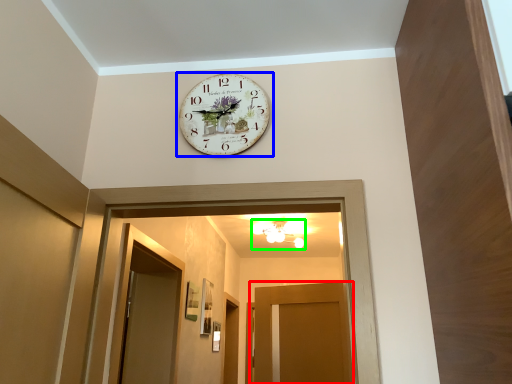
Question: Which object is positioned closest to door (highlighted by a red box)? Select from wall clock (highlighted by a blue box) and light fixture (highlighted by a green box).

Choices:
 (A) wall clock
 (B) light fixture

Answer: (B)